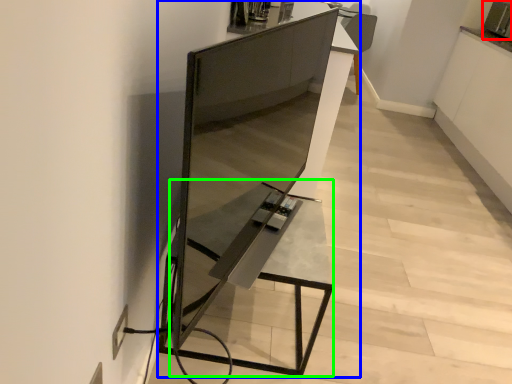
Question: Which object is positioned closest to appliance (highlighted by a red box)? Select from furniture (highlighted by a blue box) and table (highlighted by a green box).

Choices:
 (A) furniture
 (B) table

Answer: (A)